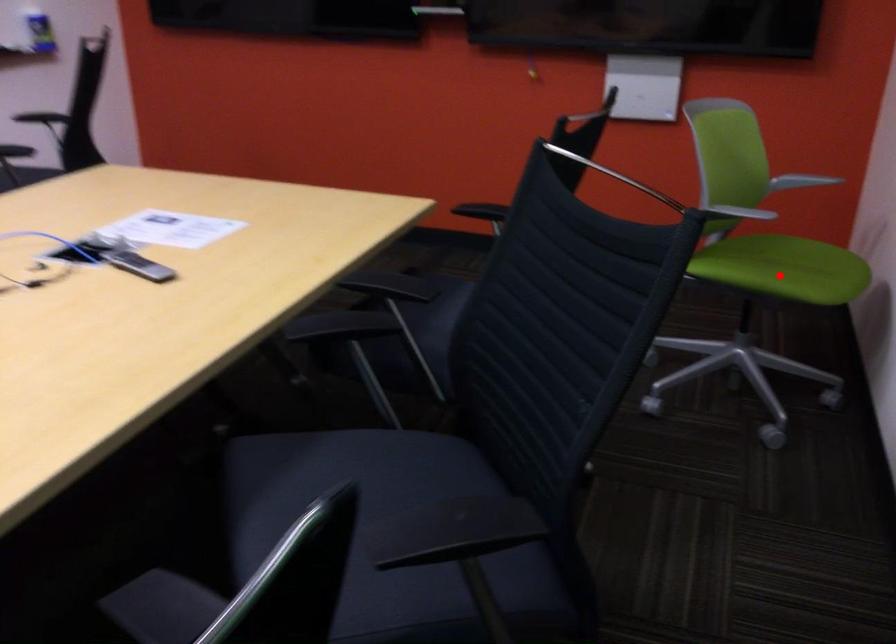
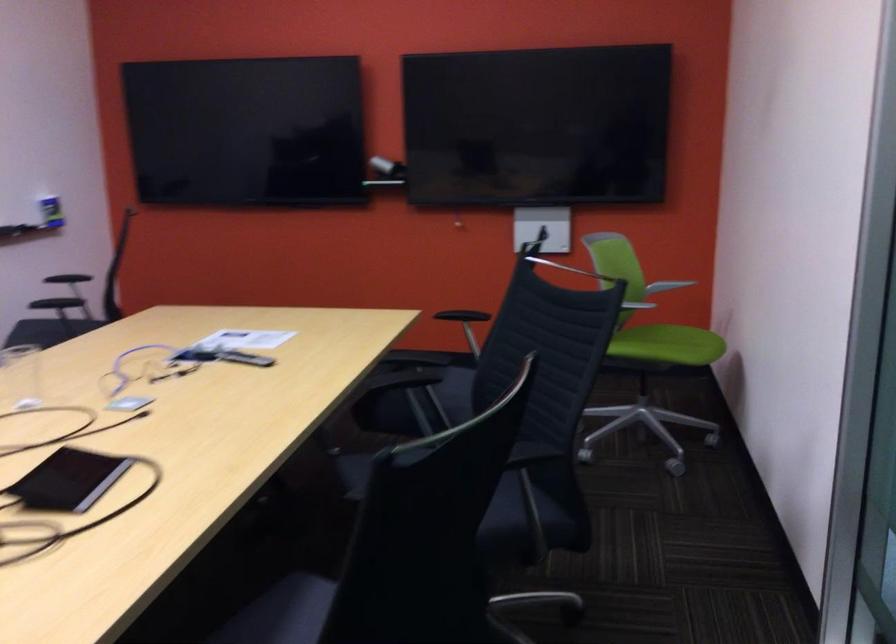
Where in the second image is the point corresponding to the highlighted location from the first image?

(667, 345)